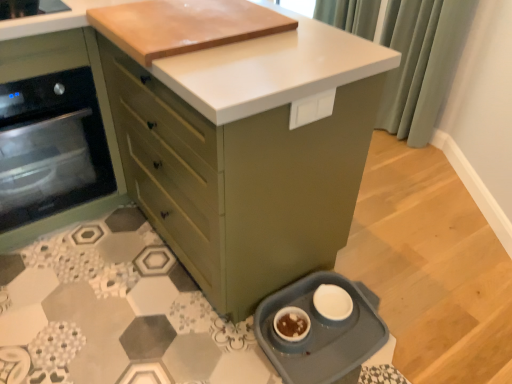
Question: Considering the relative sizes of green fabric curtain at upper right and matte green oven at left, the 1th cabinetry in the left-to-right sequence, in the image provided, is green fabric curtain at upper right wider than matte green oven at left, the 1th cabinetry in the left-to-right sequence,?

Choices:
 (A) yes
 (B) no

Answer: (B)

Question: Would you say green fabric curtain at upper right contains matte green oven at left, the 1th cabinetry in the left-to-right sequence?

Choices:
 (A) no
 (B) yes

Answer: (A)

Question: Are green fabric curtain at upper right and matte green oven at left, the 1th cabinetry in the left-to-right sequence, beside each other?

Choices:
 (A) yes
 (B) no

Answer: (B)

Question: Does green fabric curtain at upper right come in front of matte green oven at left, the 1th cabinetry in the left-to-right sequence?

Choices:
 (A) no
 (B) yes

Answer: (A)

Question: From a real-world perspective, is green fabric curtain at upper right below matte green oven at left, the second cabinetry viewed from the right?

Choices:
 (A) no
 (B) yes

Answer: (A)

Question: From a real-world perspective, is matte green cabinet at center, the first cabinetry viewed from the right, positioned above or below matte green oven at left, the 1th cabinetry in the left-to-right sequence?

Choices:
 (A) below
 (B) above

Answer: (B)

Question: From the image's perspective, is matte green cabinet at center, the first cabinetry viewed from the right, above or below matte green oven at left, the 1th cabinetry in the left-to-right sequence?

Choices:
 (A) above
 (B) below

Answer: (A)

Question: Considering the positions of matte green cabinet at center, the first cabinetry viewed from the right, and matte green oven at left, the second cabinetry viewed from the right, in the image, is matte green cabinet at center, the first cabinetry viewed from the right, wider or thinner than matte green oven at left, the second cabinetry viewed from the right,?

Choices:
 (A) wide
 (B) thin

Answer: (B)

Question: Is point (261, 177) closer or farther from the camera than point (102, 77)?

Choices:
 (A) farther
 (B) closer

Answer: (B)

Question: Is green fabric curtain at upper right taller or shorter than matte green oven at left, the second cabinetry viewed from the right?

Choices:
 (A) tall
 (B) short

Answer: (A)

Question: Choose the correct answer: Is green fabric curtain at upper right inside matte green oven at left, the second cabinetry viewed from the right, or outside it?

Choices:
 (A) inside
 (B) outside

Answer: (B)

Question: Considering the positions of green fabric curtain at upper right and matte green oven at left, the second cabinetry viewed from the right, in the image, is green fabric curtain at upper right bigger or smaller than matte green oven at left, the second cabinetry viewed from the right,?

Choices:
 (A) big
 (B) small

Answer: (B)

Question: From the image's perspective, relative to matte green oven at left, the 1th cabinetry in the left-to-right sequence, is green fabric curtain at upper right above or below?

Choices:
 (A) above
 (B) below

Answer: (A)

Question: From the image's perspective, is blue plastic pet dish at lower right positioned above or below white matte bowl at lower center?

Choices:
 (A) below
 (B) above

Answer: (B)

Question: From a real-world perspective, is blue plastic pet dish at lower right above or below white matte bowl at lower center?

Choices:
 (A) below
 (B) above

Answer: (A)